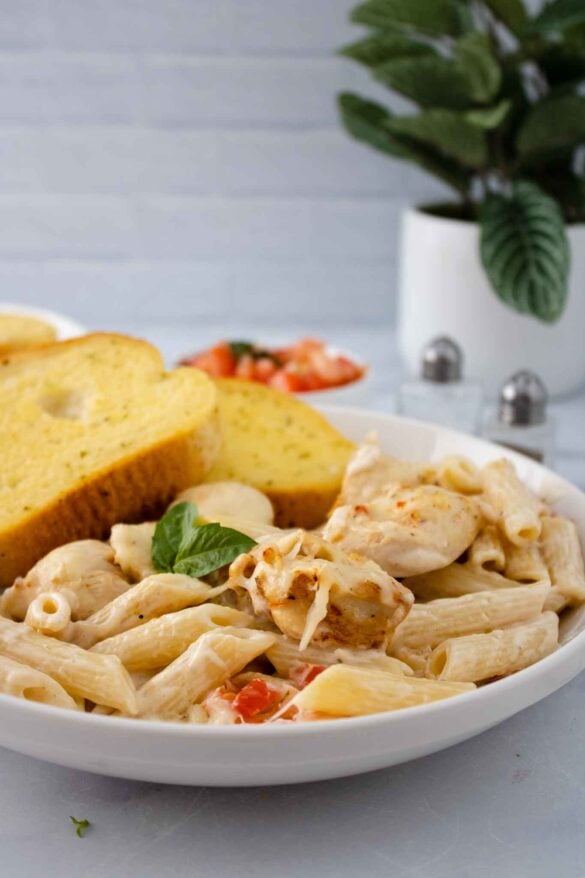
In order to click on bowl in this screenshot , I will do `click(181, 771)`.